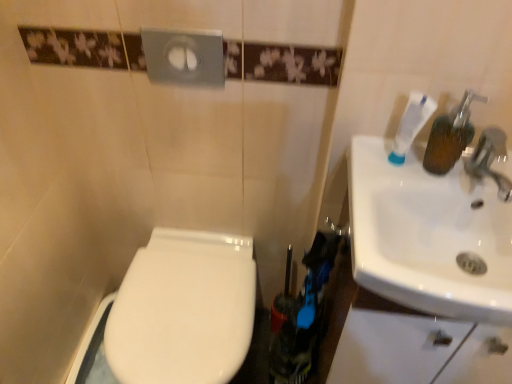
Image resolution: width=512 pixels, height=384 pixels. What are the coordinates of `space that is in front of white matte toothpaste at upper right` in the screenshot? It's located at (376, 209).